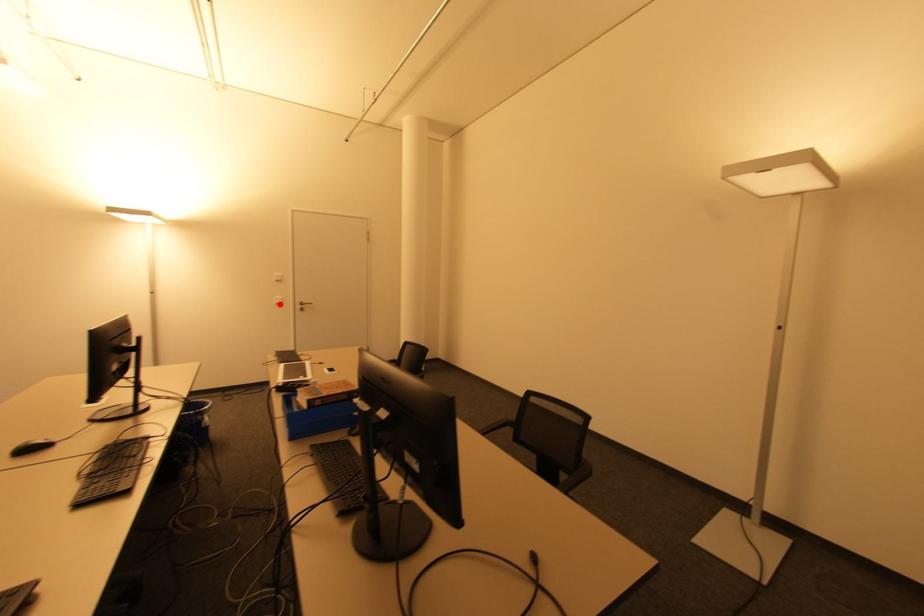
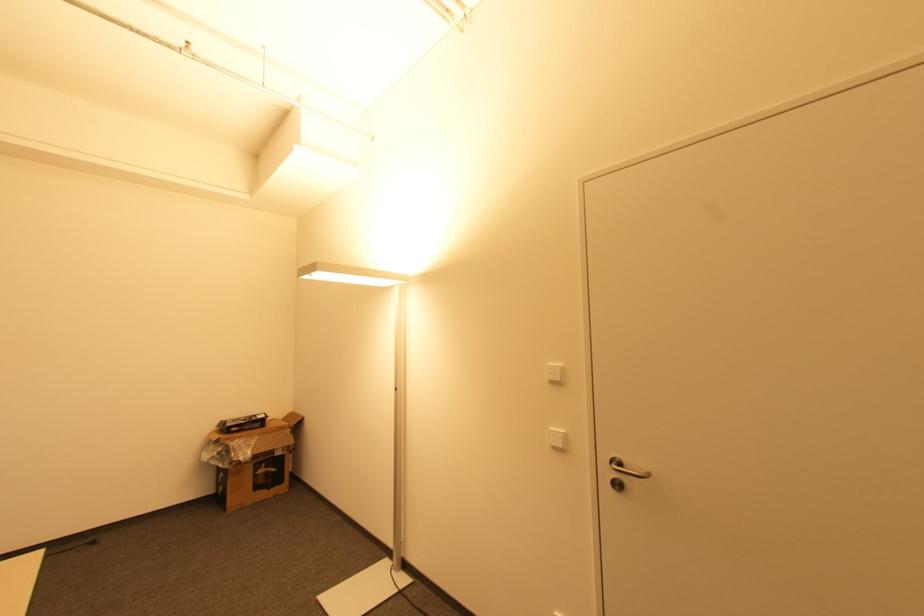
The point at the highlighted location is marked in the first image. Where is the corresponding point in the second image?

(557, 448)